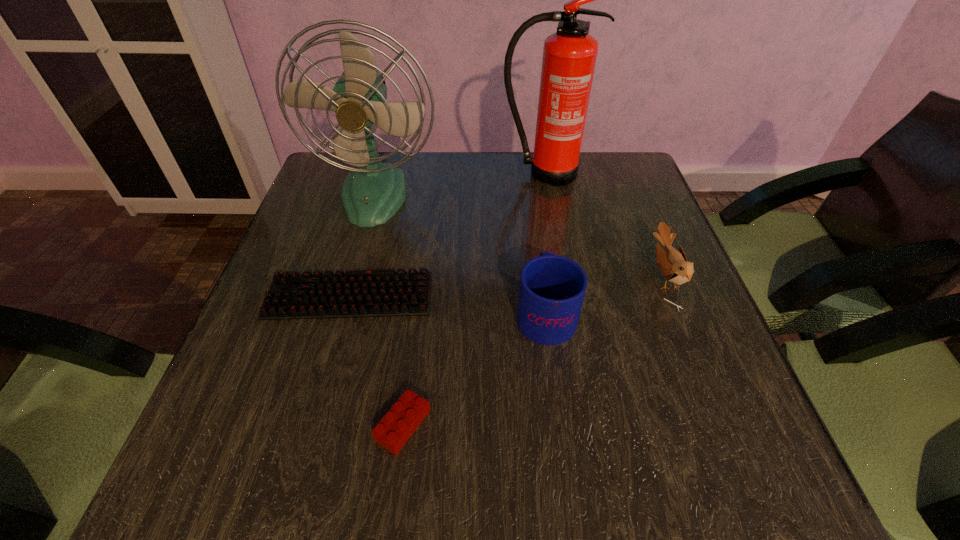
In the image, there is a desktop. Where is `vacant space at the right edge`? The width and height of the screenshot is (960, 540). vacant space at the right edge is located at coordinates (635, 234).

In the image, there is a desktop. At what (x,y) coordinates should I click in order to perform the action: click on vacant space at the far right corner. Please return your answer as a coordinate pair (x, y). Looking at the image, I should click on (636, 175).

This screenshot has height=540, width=960. In order to click on vacant area that lies between the fire extinguisher and the fan in this screenshot , I will do `click(459, 184)`.

I want to click on vacant area that lies between the shortest object and the fan, so click(362, 245).

Find the location of a particular element. This screenshot has width=960, height=540. free spot between the fan and the fire extinguisher is located at coordinates (459, 184).

The image size is (960, 540). I want to click on empty space between the computer keyboard and the nearest object, so click(x=376, y=361).

Identify the location of vacant space in between the fire extinguisher and the bird. (604, 225).

The width and height of the screenshot is (960, 540). I want to click on empty space between the mug and the shortest object, so click(447, 304).

The image size is (960, 540). In order to click on vacant region between the mug and the computer keyboard in this screenshot , I will do (447, 304).

I want to click on free space between the Lego and the bird, so click(534, 351).